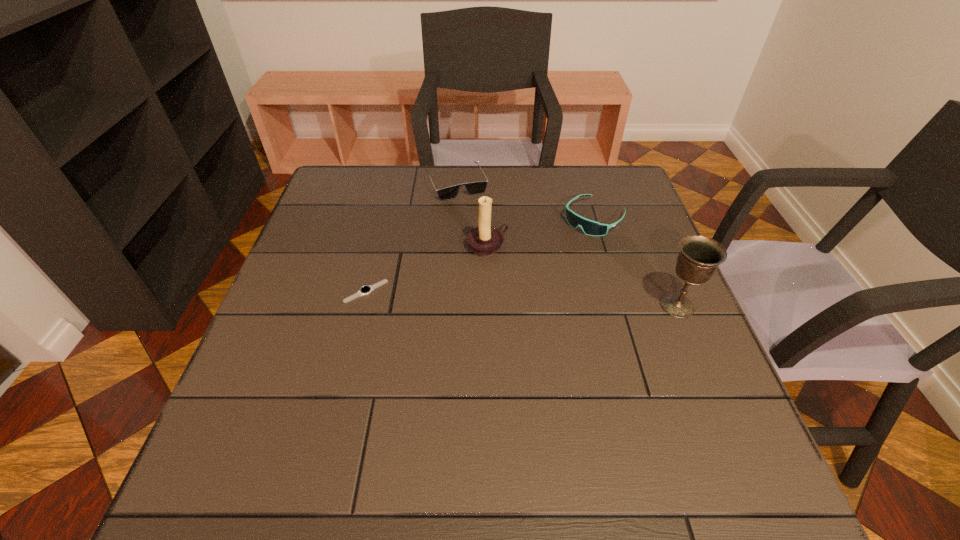
This screenshot has height=540, width=960. Find the location of `vacant space at the near right corner of the desktop`. vacant space at the near right corner of the desktop is located at coordinates (698, 429).

This screenshot has height=540, width=960. What are the coordinates of `free point between the chalice and the leftmost object` in the screenshot? It's located at (521, 299).

Identify the location of vacant area that lies between the candle holder and the leftmost object. (426, 269).

Find the location of a particular element. This screenshot has height=540, width=960. vacant area that lies between the shorter sunglasses and the shortest object is located at coordinates (411, 238).

Find the location of `vacant space that is in between the leftmost object and the candle holder`. vacant space that is in between the leftmost object and the candle holder is located at coordinates (426, 269).

Locate an element on the screen. The width and height of the screenshot is (960, 540). vacant space in between the watch and the chalice is located at coordinates (521, 299).

What are the coordinates of `vacant region between the shorter sunglasses and the candle holder` in the screenshot? It's located at (471, 215).

Find the location of a particular element. free point between the shorter sunglasses and the chalice is located at coordinates (566, 245).

This screenshot has width=960, height=540. Identify the location of vacant point located between the taller sunglasses and the chalice. (636, 262).

Find the location of a particular element. The height and width of the screenshot is (540, 960). free space that is in between the chalice and the candle holder is located at coordinates (583, 276).